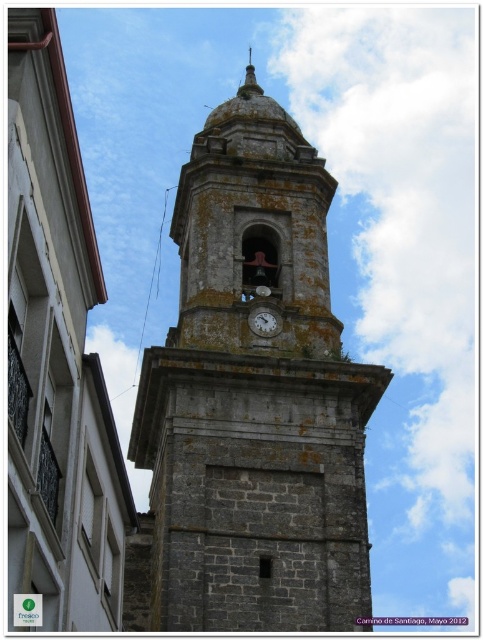
What is located at the point with coordinates (x=252, y=401) in the image?

The gray stone clock tower at center is located at point (x=252, y=401).

You are standing at the origin point in the image. Which direction should you move to reach the gray stone clock tower at center?

The gray stone clock tower at center is located at coordinates approximately 0.628 along the x axis and 0.522 along the y axis. Since you are at the origin point, you need to move to the right along the x axis and slightly upwards along the y axis to reach it.